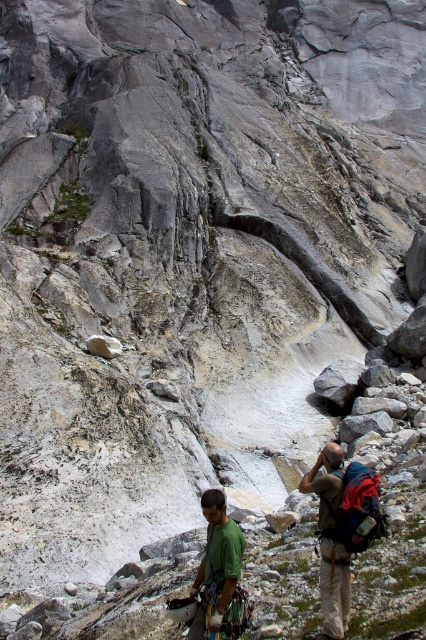
Does green matte shirt at lower center have a larger size compared to gray rough rock at center?

Yes, green matte shirt at lower center is bigger than gray rough rock at center.

Does point (233, 618) come in front of point (101, 349)?

Yes, it is in front of point (101, 349).

Does point (213, 515) lie behind point (101, 355)?

That is False.

Identify the location of green matte shirt at lower center. [x=218, y=573].